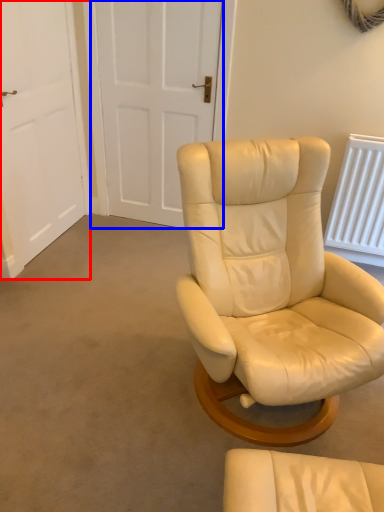
Question: Among these objects, which one is farthest to the camera, door (highlighted by a red box) or door (highlighted by a blue box)?

Choices:
 (A) door
 (B) door

Answer: (B)